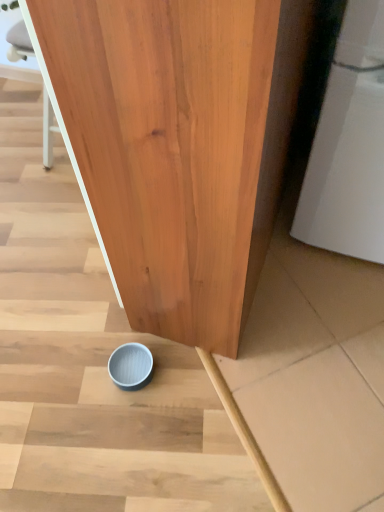
This screenshot has width=384, height=512. What do you see at coordinates (91, 362) in the screenshot?
I see `blue matte bowl at lower center` at bounding box center [91, 362].

Measure the distance between blue matte bowl at lower center and camera.

blue matte bowl at lower center and camera are 35.87 inches apart from each other.

The image size is (384, 512). What are the coordinates of `blue matte bowl at lower center` in the screenshot? It's located at click(91, 362).

The width and height of the screenshot is (384, 512). What do you see at coordinates (131, 366) in the screenshot?
I see `light blue matte bowl at lower center` at bounding box center [131, 366].

Where is `light blue matte bowl at lower center`? The image size is (384, 512). light blue matte bowl at lower center is located at coordinates (131, 366).

This screenshot has width=384, height=512. Find the location of `blue matte bowl at lower center`. blue matte bowl at lower center is located at coordinates (91, 362).

Which object is positioned more to the right, blue matte bowl at lower center or light blue matte bowl at lower center?

blue matte bowl at lower center.

Considering the positions of objects blue matte bowl at lower center and light blue matte bowl at lower center in the image provided, who is behind, blue matte bowl at lower center or light blue matte bowl at lower center?

Positioned behind is light blue matte bowl at lower center.

Considering the positions of point (36, 361) and point (133, 373), is point (36, 361) closer or farther from the camera than point (133, 373)?

Point (36, 361) is positioned farther from the camera compared to point (133, 373).

From the image's perspective, which one is positioned lower, blue matte bowl at lower center or light blue matte bowl at lower center?

light blue matte bowl at lower center appears lower in the image.

From a real-world perspective, which is physically below, blue matte bowl at lower center or light blue matte bowl at lower center?

light blue matte bowl at lower center, from a real-world perspective.

In the scene shown: Considering the relative sizes of blue matte bowl at lower center and light blue matte bowl at lower center in the image provided, is blue matte bowl at lower center wider than light blue matte bowl at lower center?

Indeed, blue matte bowl at lower center has a greater width compared to light blue matte bowl at lower center.

Between blue matte bowl at lower center and light blue matte bowl at lower center, which one has more height?

With more height is blue matte bowl at lower center.

Can you confirm if blue matte bowl at lower center is bigger than light blue matte bowl at lower center?

Indeed, blue matte bowl at lower center has a larger size compared to light blue matte bowl at lower center.

Is light blue matte bowl at lower center inside blue matte bowl at lower center?

Yes, light blue matte bowl at lower center is a part of blue matte bowl at lower center.

Is blue matte bowl at lower center not near light blue matte bowl at lower center?

They are positioned close to each other.

Does blue matte bowl at lower center turn towards light blue matte bowl at lower center?

No, blue matte bowl at lower center is not aimed at light blue matte bowl at lower center.

What's the angular difference between blue matte bowl at lower center and light blue matte bowl at lower center's facing directions?

The facing directions of blue matte bowl at lower center and light blue matte bowl at lower center are 10.6 degrees apart.

Where is `stairwell that appears above the light blue matte bowl at lower center (from a real-world perspective)`? The height and width of the screenshot is (512, 384). stairwell that appears above the light blue matte bowl at lower center (from a real-world perspective) is located at coordinates (91, 362).

In the image, is light blue matte bowl at lower center on the left side or the right side of blue matte bowl at lower center?

light blue matte bowl at lower center is positioned on blue matte bowl at lower center's left side.

Is the position of light blue matte bowl at lower center more distant than that of blue matte bowl at lower center?

Yes, light blue matte bowl at lower center is further from the camera.

Is point (132, 379) more distant than point (96, 328)?

No, (132, 379) is closer to viewer.

From the image's perspective, is light blue matte bowl at lower center above or below blue matte bowl at lower center?

light blue matte bowl at lower center is situated lower than blue matte bowl at lower center in the image.

From a real-world perspective, does light blue matte bowl at lower center sit lower than blue matte bowl at lower center?

Indeed, from a real-world perspective, light blue matte bowl at lower center is positioned beneath blue matte bowl at lower center.

Considering the relative sizes of light blue matte bowl at lower center and blue matte bowl at lower center in the image provided, is light blue matte bowl at lower center thinner than blue matte bowl at lower center?

Yes.

Which of these two, light blue matte bowl at lower center or blue matte bowl at lower center, stands taller?

blue matte bowl at lower center.

Is light blue matte bowl at lower center bigger than blue matte bowl at lower center?

Incorrect, light blue matte bowl at lower center is not larger than blue matte bowl at lower center.

Is light blue matte bowl at lower center spatially inside blue matte bowl at lower center, or outside of it?

light blue matte bowl at lower center lies within the bounds of blue matte bowl at lower center.

Is light blue matte bowl at lower center far away from blue matte bowl at lower center?

They are positioned close to each other.

Is light blue matte bowl at lower center aimed at blue matte bowl at lower center?

Yes, light blue matte bowl at lower center is aimed at blue matte bowl at lower center.

This screenshot has height=512, width=384. Find the location of `stairwell above the light blue matte bowl at lower center (from a real-world perspective)`. stairwell above the light blue matte bowl at lower center (from a real-world perspective) is located at coordinates (91, 362).

Image resolution: width=384 pixels, height=512 pixels. Identify the location of tableware directly beneath the blue matte bowl at lower center (from a real-world perspective). (131, 366).

Where is `stairwell above the light blue matte bowl at lower center (from the image's perspective)`? stairwell above the light blue matte bowl at lower center (from the image's perspective) is located at coordinates (91, 362).